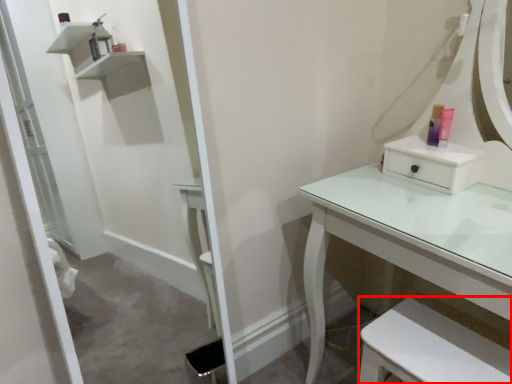
Question: From the image, what is the correct spatial relationship of step stool (annotated by the red box) in relation to toiletry?

Choices:
 (A) right
 (B) left

Answer: (B)